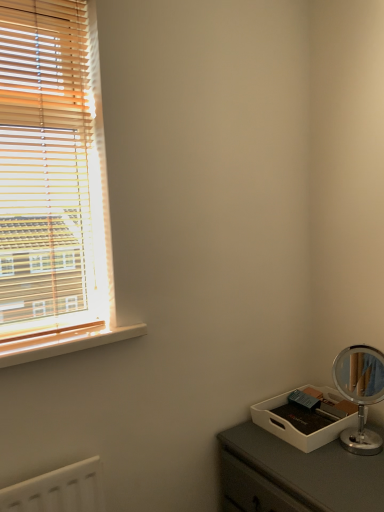
Where is `wooden at left`? wooden at left is located at coordinates (64, 342).

The width and height of the screenshot is (384, 512). Describe the element at coordinates (64, 342) in the screenshot. I see `wooden at left` at that location.

This screenshot has height=512, width=384. I want to click on wooden blinds at left, so click(x=53, y=185).

The height and width of the screenshot is (512, 384). Describe the element at coordinates (53, 185) in the screenshot. I see `wooden blinds at left` at that location.

In order to click on wooden at left in this screenshot , I will do `click(64, 342)`.

Between wooden at left and wooden blinds at left, which one appears on the left side from the viewer's perspective?

wooden blinds at left.

Is wooden at left closer to camera compared to wooden blinds at left?

No, wooden at left is further to the viewer.

Which is in front, point (105, 342) or point (27, 154)?

Positioned in front is point (27, 154).

From the image's perspective, is wooden at left on top of wooden blinds at left?

Actually, wooden at left appears below wooden blinds at left in the image.

From a real-world perspective, is wooden at left physically located above or below wooden blinds at left?

wooden at left is below wooden blinds at left.

Consider the image. Which of these two, wooden at left or wooden blinds at left, is thinner?

wooden blinds at left.

Who is shorter, wooden at left or wooden blinds at left?

wooden at left is shorter.

Based on their sizes in the image, would you say wooden at left is bigger or smaller than wooden blinds at left?

wooden at left is smaller than wooden blinds at left.

From the picture: Could wooden blinds at left be considered to be inside wooden at left?

No, wooden at left does not contain wooden blinds at left.

Is wooden at left not close to wooden blinds at left?

wooden at left is near wooden blinds at left, not far away.

Is wooden at left oriented away from wooden blinds at left?

Yes, wooden at left's orientation is away from wooden blinds at left.

At what (x,y) coordinates should I click in order to perform the action: click on window that appears above the wooden at left (from the image's perspective). Please return your answer as a coordinate pair (x, y). This screenshot has width=384, height=512. Looking at the image, I should click on (53, 185).

In the image, is wooden blinds at left on the left side or the right side of wooden at left?

Clearly, wooden blinds at left is on the left of wooden at left in the image.

Does wooden blinds at left come in front of wooden at left?

Yes, wooden blinds at left is closer to the viewer.

Is point (30, 134) in front of point (90, 339)?

Yes, point (30, 134) is in front of point (90, 339).

From the image's perspective, which object appears higher, wooden blinds at left or wooden at left?

wooden blinds at left.

From a real-world perspective, is wooden blinds at left positioned over wooden at left based on gravity?

Yes, from a real-world perspective, wooden blinds at left is over wooden at left

Considering the sizes of objects wooden blinds at left and wooden at left in the image provided, who is wider, wooden blinds at left or wooden at left?

Wider between the two is wooden at left.

From their relative heights in the image, would you say wooden blinds at left is taller or shorter than wooden at left?

Considering their sizes, wooden blinds at left has more height than wooden at left.

Considering the sizes of objects wooden blinds at left and wooden at left in the image provided, who is smaller, wooden blinds at left or wooden at left?

Smaller between the two is wooden at left.

In the scene shown: Would you say wooden at left is part of wooden blinds at left's contents?

No, wooden at left is not a part of wooden blinds at left.

Based on the photo, would you consider wooden blinds at left to be distant from wooden at left?

That's not correct — wooden blinds at left is a little close to wooden at left.

Is wooden blinds at left positioned with its back to wooden at left?

No, wooden blinds at left is not facing the opposite direction of wooden at left.

How far apart are wooden blinds at left and wooden at left?

wooden blinds at left and wooden at left are 11.78 inches apart from each other.

What are the coordinates of `window located in front of the wooden at left` in the screenshot? It's located at (53, 185).

Where is `window sill below the wooden blinds at left (from the image's perspective)`? The height and width of the screenshot is (512, 384). window sill below the wooden blinds at left (from the image's perspective) is located at coordinates (64, 342).

This screenshot has height=512, width=384. Identify the location of window sill below the wooden blinds at left (from a real-world perspective). (64, 342).